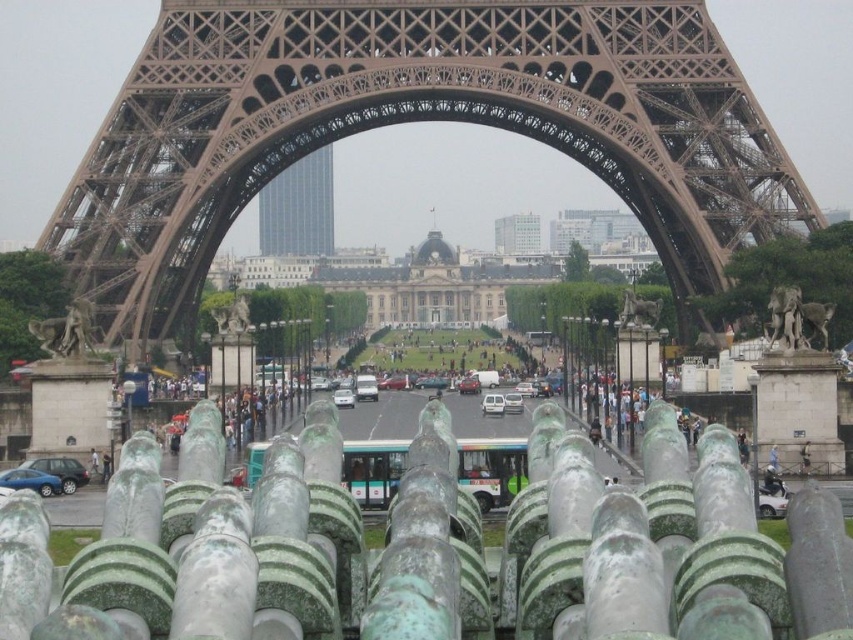
Is brown metal eiffel tower at center smaller than blue metallic car at lower left?

No, brown metal eiffel tower at center is not smaller than blue metallic car at lower left.

Does brown metal eiffel tower at center have a lesser height compared to blue metallic car at lower left?

No, brown metal eiffel tower at center is not shorter than blue metallic car at lower left.

What do you see at coordinates (413, 120) in the screenshot?
I see `brown metal eiffel tower at center` at bounding box center [413, 120].

Where is `brown metal eiffel tower at center`? brown metal eiffel tower at center is located at coordinates (413, 120).

Who is higher up, blue metallic car at lower left or white glossy car at center?

Positioned higher is blue metallic car at lower left.

Is point (36, 474) closer to viewer compared to point (772, 506)?

No, (36, 474) is further to viewer.

This screenshot has width=853, height=640. What do you see at coordinates (32, 481) in the screenshot? I see `blue metallic car at lower left` at bounding box center [32, 481].

Find the location of a particular element. blue metallic car at lower left is located at coordinates (32, 481).

I want to click on brown metal eiffel tower at center, so click(x=413, y=120).

Image resolution: width=853 pixels, height=640 pixels. Identify the location of brown metal eiffel tower at center. (413, 120).